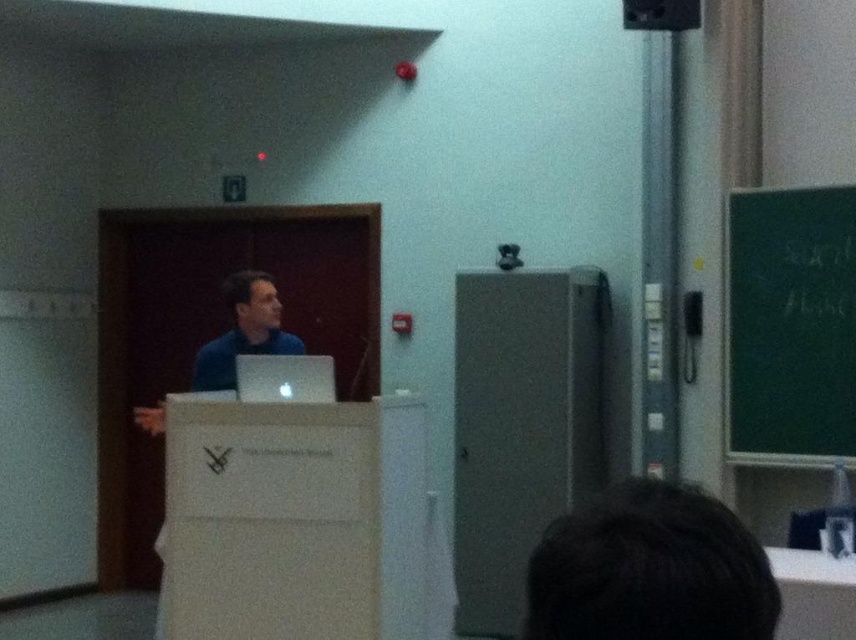
Is point (795, 193) less distant than point (605, 554)?

No, (795, 193) is behind (605, 554).

Is green chalkboard at upper right positioned behind dark brown hair at lower center?

Yes.

Find the location of a particular element. The width and height of the screenshot is (856, 640). green chalkboard at upper right is located at coordinates tap(789, 324).